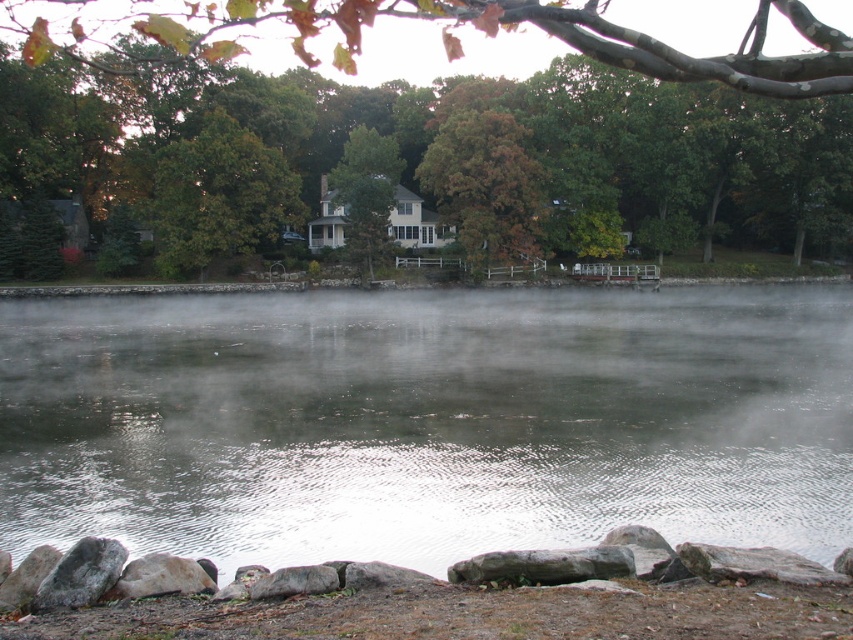
Can you confirm if translucent misty water at center is positioned above green leafy tree at center?

Incorrect, translucent misty water at center is not positioned above green leafy tree at center.

Who is higher up, translucent misty water at center or green leafy tree at center?

green leafy tree at center is above.

Who is more distant from viewer, (x=695, y=410) or (x=227, y=208)?

Point (x=227, y=208)

You are a GUI agent. You are given a task and a screenshot of the screen. Output one action in this format:
    pyautogui.click(x=<x>, y=<y>)
    Task: Click on the translucent misty water at center
    The width and height of the screenshot is (853, 640).
    Given the screenshot: What is the action you would take?
    pyautogui.click(x=426, y=420)

Can you confirm if gray rough stone at lower center is taller than gray rough rock at lower left?

Incorrect, gray rough stone at lower center's height is not larger of gray rough rock at lower left's.

Which is behind, point (627, 572) or point (112, 564)?

The point (112, 564) is behind.

The height and width of the screenshot is (640, 853). I want to click on gray rough stone at lower center, so click(544, 564).

Identify the location of gray rough stone at lower center. (544, 564).

Does gray rough stone at lower center have a greater width compared to smooth gray rock at lower left?

Correct, the width of gray rough stone at lower center exceeds that of smooth gray rock at lower left.

Does gray rough stone at lower center appear under smooth gray rock at lower left?

Incorrect, gray rough stone at lower center is not positioned below smooth gray rock at lower left.

Locate an element on the screen. gray rough stone at lower center is located at coordinates [544, 564].